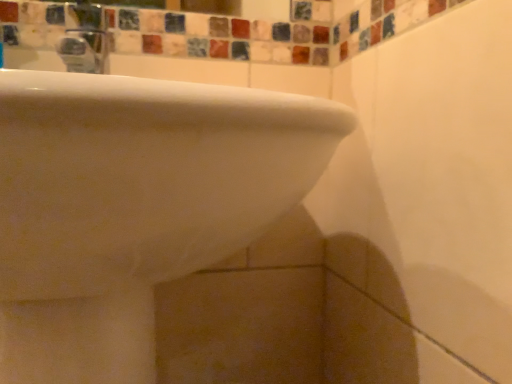
What do you see at coordinates (133, 206) in the screenshot? I see `white glossy sink at upper left` at bounding box center [133, 206].

Identify the location of white glossy sink at upper left. This screenshot has width=512, height=384. (133, 206).

Measure the distance between white glossy sink at upper left and camera.

white glossy sink at upper left is 7.18 inches from camera.

Where is `white glossy sink at upper left`? The width and height of the screenshot is (512, 384). white glossy sink at upper left is located at coordinates (133, 206).